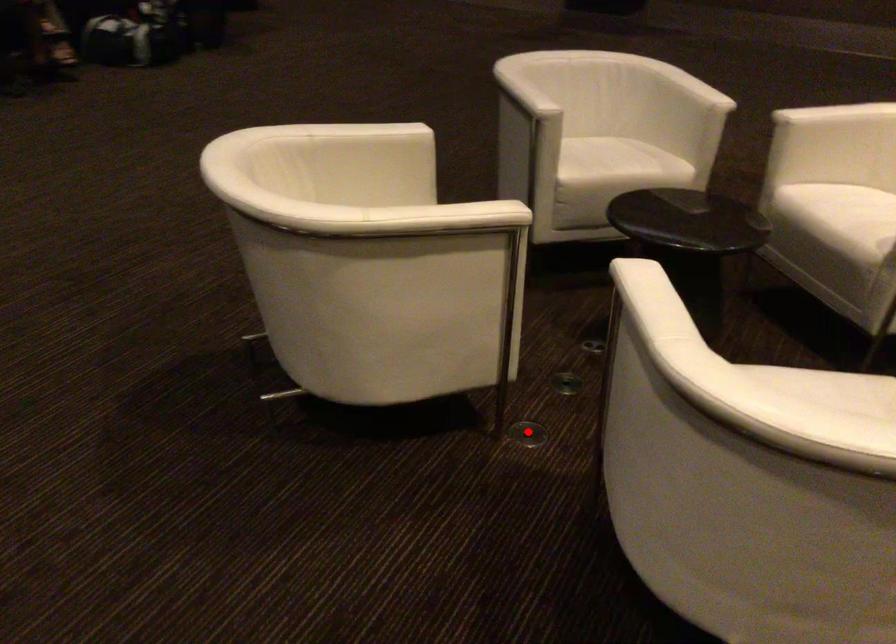
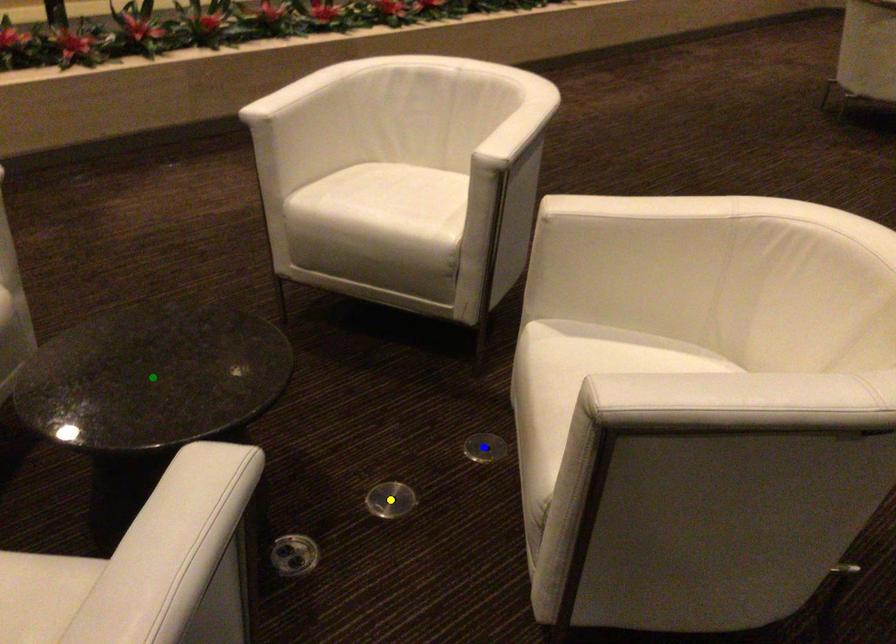
Question: I am providing you with two images of the same scene from different viewpoints. A red point is marked on the first image. You are given multiple points on the second image. Which point in image 2 represents the same 3d spot as the red point in image 1?

Choices:
 (A) blue point
 (B) green point
 (C) yellow point

Answer: (A)